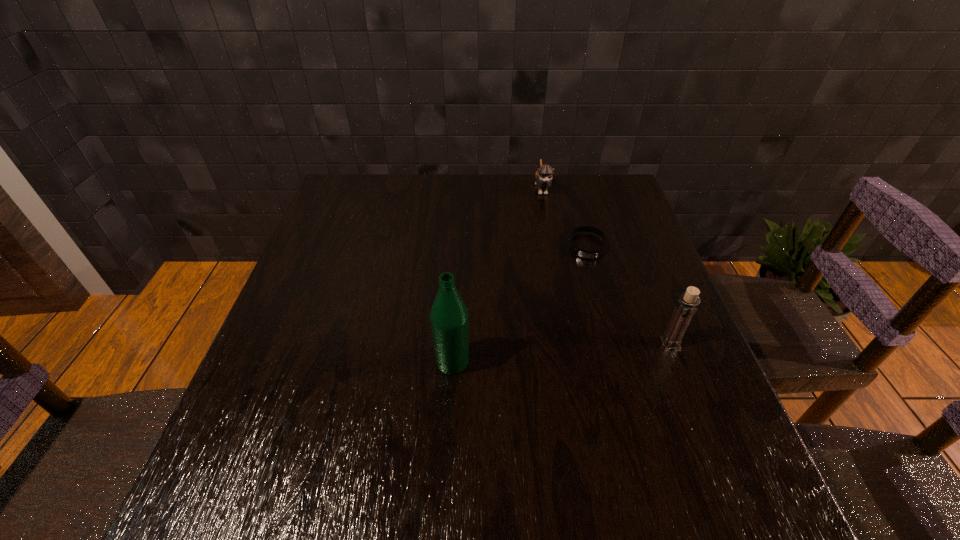
Find the location of a particular element. This screenshot has width=960, height=540. the leftmost object is located at coordinates (449, 317).

Image resolution: width=960 pixels, height=540 pixels. I want to click on bottle, so click(x=449, y=317).

At what (x,y) coordinates should I click in order to perform the action: click on the third shortest object. Please return your answer as a coordinate pair (x, y). Looking at the image, I should click on click(x=686, y=306).

At what (x,y) coordinates should I click in order to perform the action: click on candle holder. Please return your answer as a coordinate pair (x, y). This screenshot has width=960, height=540. Looking at the image, I should click on (686, 306).

Where is `the shortest object`? This screenshot has width=960, height=540. the shortest object is located at coordinates (587, 254).

Locate an element on the screen. the second object from right to left is located at coordinates (587, 254).

At what (x,y) coordinates should I click in order to perform the action: click on the second shortest object. Please return your answer as a coordinate pair (x, y). Image resolution: width=960 pixels, height=540 pixels. Looking at the image, I should click on (543, 177).

This screenshot has width=960, height=540. Find the location of `the second object from left to right`. the second object from left to right is located at coordinates (543, 177).

Find the location of `vacant area located 0.320m on the back of the leftmost object`. vacant area located 0.320m on the back of the leftmost object is located at coordinates (459, 252).

Locate an element on the screen. The height and width of the screenshot is (540, 960). vacant space positioned on the front of the candle holder is located at coordinates (704, 429).